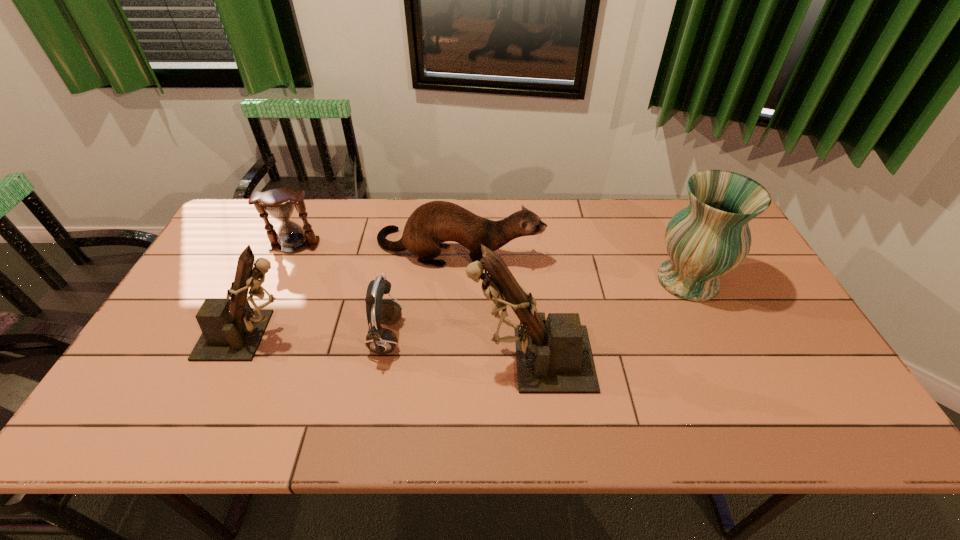
At what (x,y) coordinates should I click in order to perform the action: click on object that stands as the second closest to the tallest object. Please return your answer as a coordinate pair (x, y). Looking at the image, I should click on (431, 224).

Point out which object is positioned as the fourth nearest to the right figurine. Please provide its 2D coordinates. Your answer should be formatted as a tuple, i.e. [(x, y)], where the tuple contains the x and y coordinates of a point satisfying the conditions above.

[(231, 330)]

Locate an element on the screen. This screenshot has width=960, height=540. free space that satisfies the following two spatial constraints: 1. at the face of the vase; 2. on the right side of the ferret is located at coordinates (456, 280).